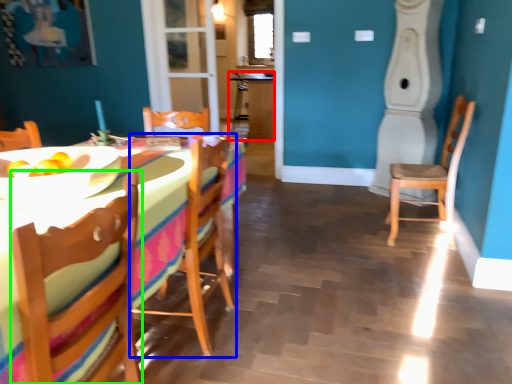
Question: Which object is the closest to the table (highlighted by a red box)? Choose among these: chair (highlighted by a blue box) or chair (highlighted by a green box).

Choices:
 (A) chair
 (B) chair

Answer: (A)